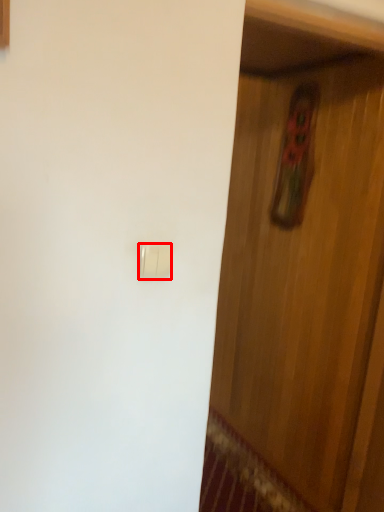
Question: From the image's perspective, what is the correct spatial positioning of light switch (annotated by the red box) in reference to door?

Choices:
 (A) below
 (B) above

Answer: (B)